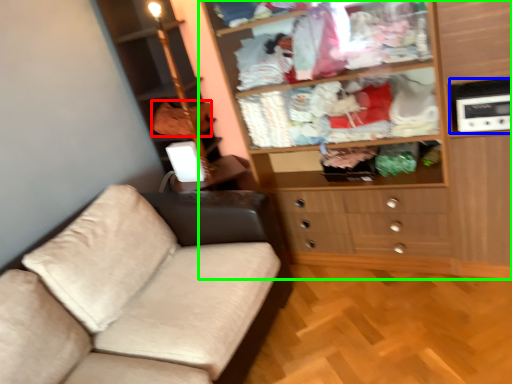
Question: Estimate the real-world distances between objects in this image. Which object is closer to clothing (highlighted by a red box), appliance (highlighted by a blue box) or cupboard (highlighted by a green box)?

Choices:
 (A) appliance
 (B) cupboard

Answer: (B)